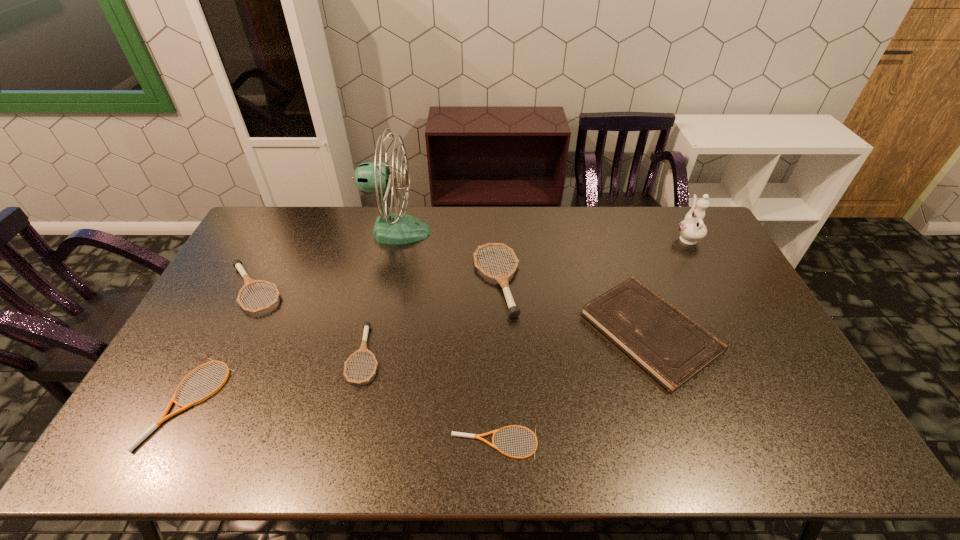
You are a GUI agent. You are given a task and a screenshot of the screen. Output one action in this format:
    pyautogui.click(x=<x>, y=<y>)
    Task: Click on the vacant point located on the back of the left beige tennis racket
    
    Given the screenshot: What is the action you would take?
    pyautogui.click(x=246, y=295)

You are a GUI agent. You are given a task and a screenshot of the screen. Output one action in this format:
    pyautogui.click(x=<x>, y=<y>)
    Task: Click on the free space located on the right of the shortest tennis racket
    The height and width of the screenshot is (540, 960).
    Given the screenshot: What is the action you would take?
    pyautogui.click(x=575, y=443)

Locate an element on the screen. The width and height of the screenshot is (960, 540). fan situated at the far edge is located at coordinates (378, 178).

Where is `chinaware present at the far edge`? chinaware present at the far edge is located at coordinates (692, 228).

Image resolution: width=960 pixels, height=540 pixels. Find the location of `chinaware present at the right edge`. chinaware present at the right edge is located at coordinates (692, 228).

Locate an element on the screen. This screenshot has width=960, height=540. paperback book present at the right edge is located at coordinates (670, 346).

This screenshot has width=960, height=540. Find the location of `object that is at the near left corner`. object that is at the near left corner is located at coordinates click(x=163, y=417).

Locate an element on the screen. object present at the far right corner is located at coordinates (692, 228).

Find the location of `vacant region at the far edge of the desktop`. vacant region at the far edge of the desktop is located at coordinates [585, 234].

This screenshot has height=540, width=960. What are the coordinates of `vacant area at the near edge` in the screenshot? It's located at (739, 428).